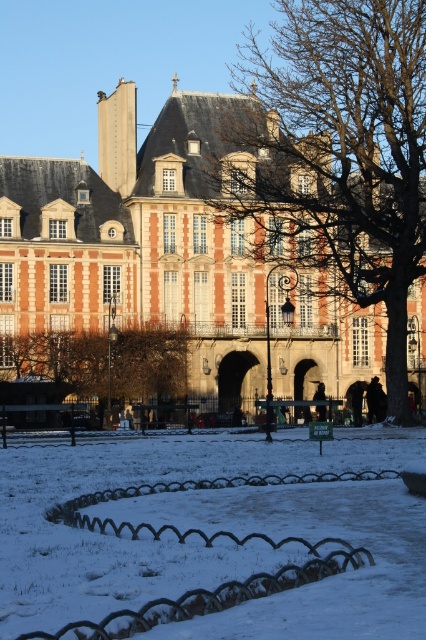
You are standing at the center of the snow covered lawn in front of the matte brick building at center. If you walk straight towards the building, will you reach the building before reaching the wrought iron fence?

Yes, because the distance from the center of the snow covered lawn to the matte brick building at center is shorter than to the wrought iron fence.

You are an architect analyzing the winter scene. You observe the matte brick building at center and the brown textured tree at center. Which structure has a greater vertical height in this image?

The matte brick building at center is taller than the brown textured tree at center according to the description.